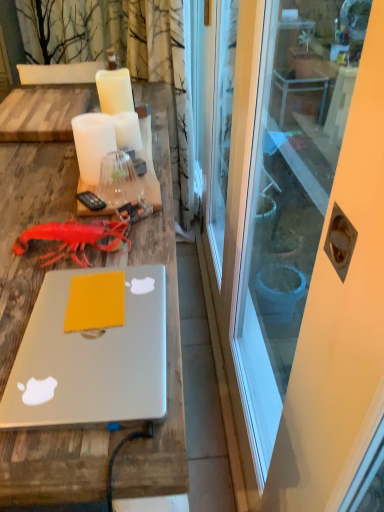
Where is `vacant area on top of silver metallic laptop at center (from a real-world perspective)`? vacant area on top of silver metallic laptop at center (from a real-world perspective) is located at coordinates (89, 325).